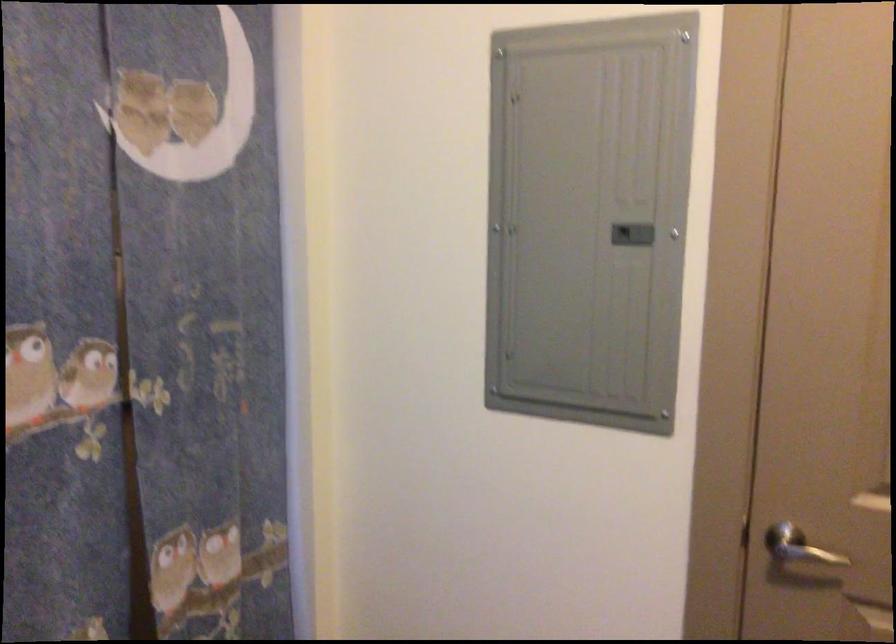
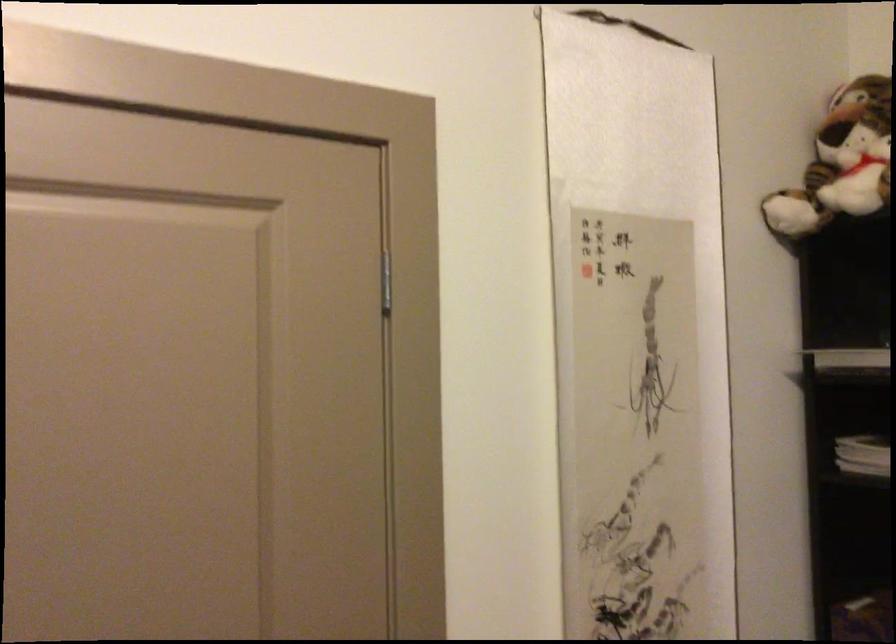
Question: The camera is either moving clockwise (left) or counter-clockwise (right) around the object. The first image is from the beginning of the video and the second image is from the end. Is the camera moving left or right when shooting the video?

Choices:
 (A) Left
 (B) Right

Answer: (A)